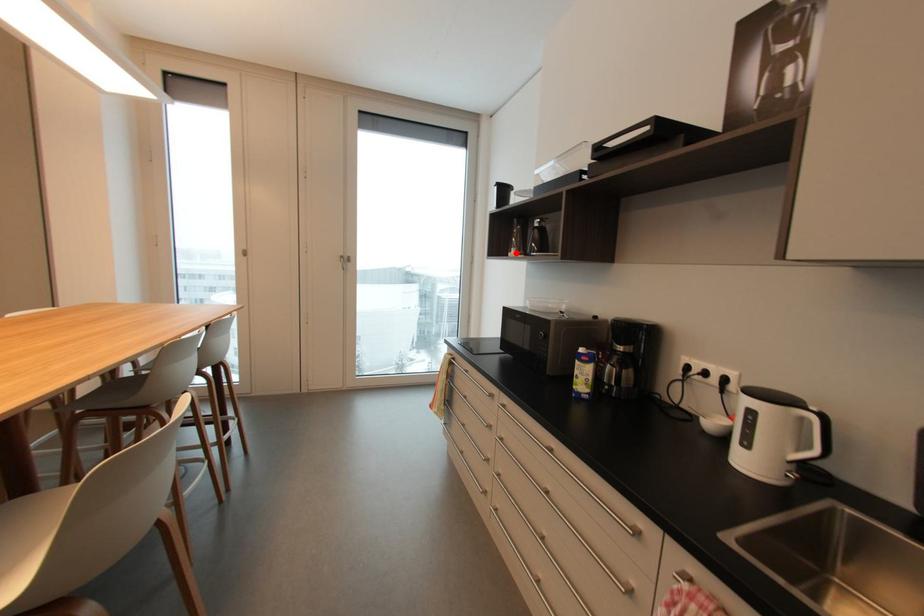
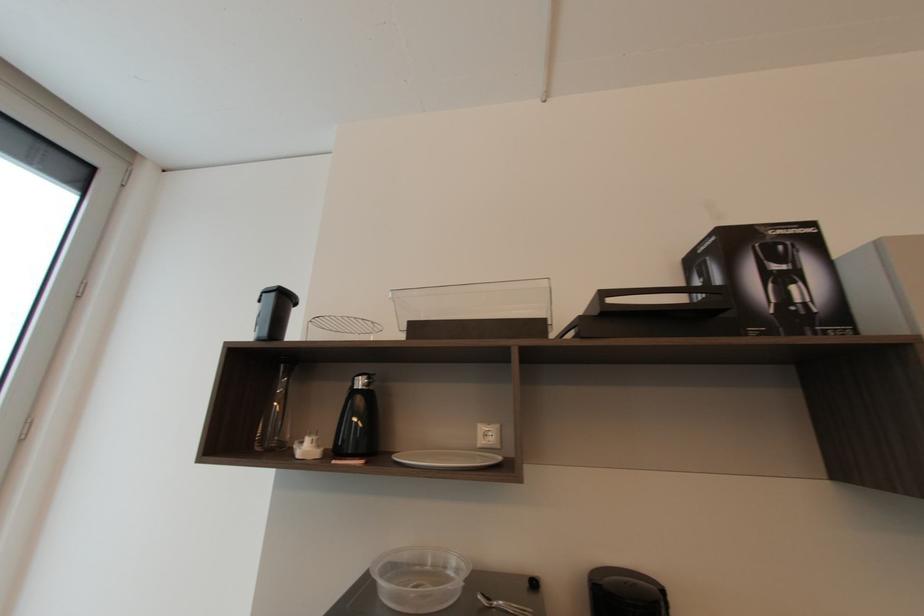
The point at the highlighted location is marked in the first image. Where is the corresponding point in the second image?

(310, 447)